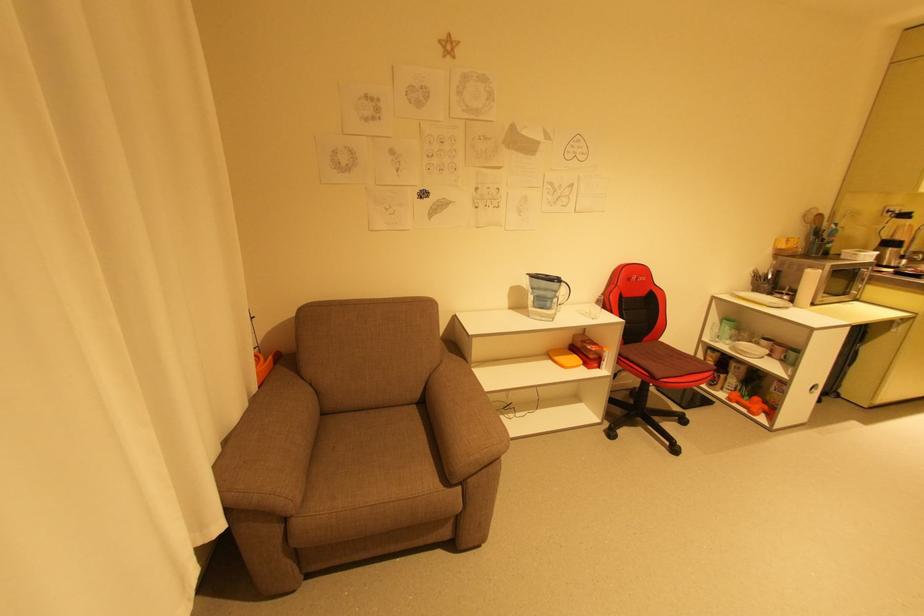
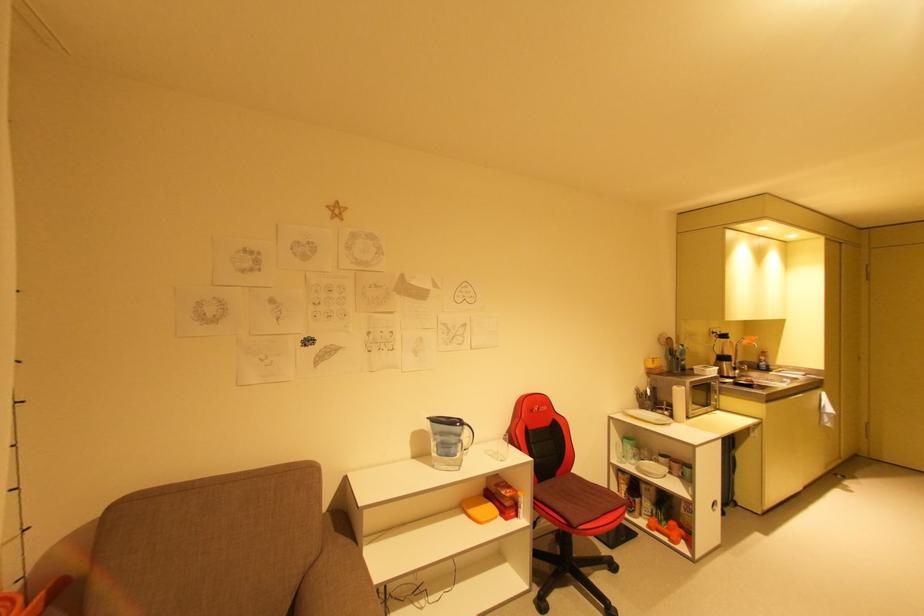
Locate, in the second image, the point that corresponds to (757,410) in the first image.

(675, 538)